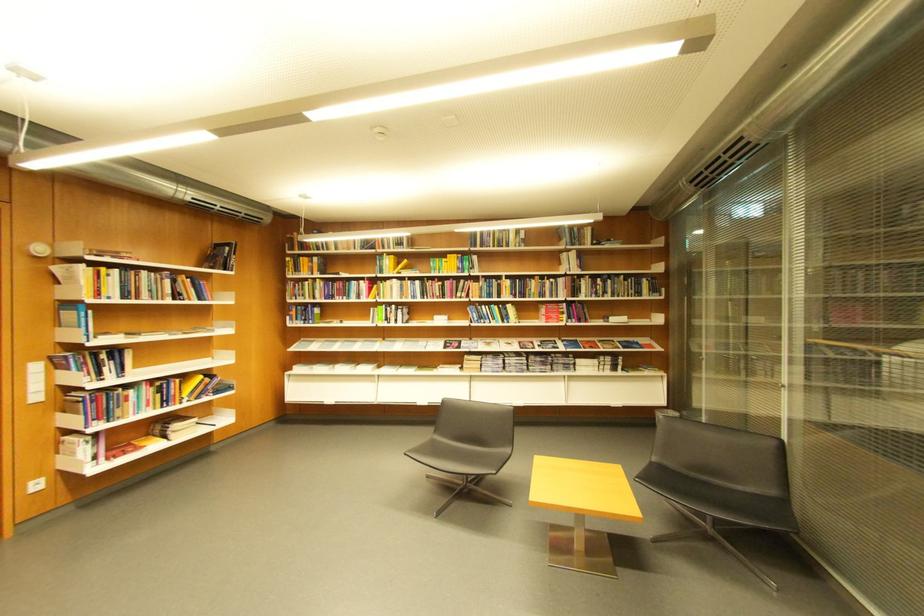
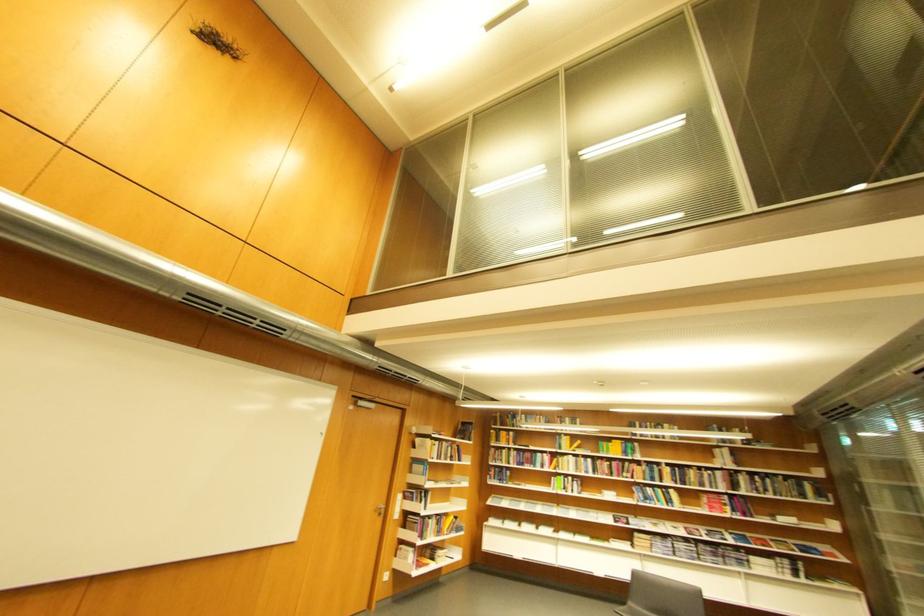
In the second image, find the point that corresponds to point 186,301 in the first image.

(460, 461)